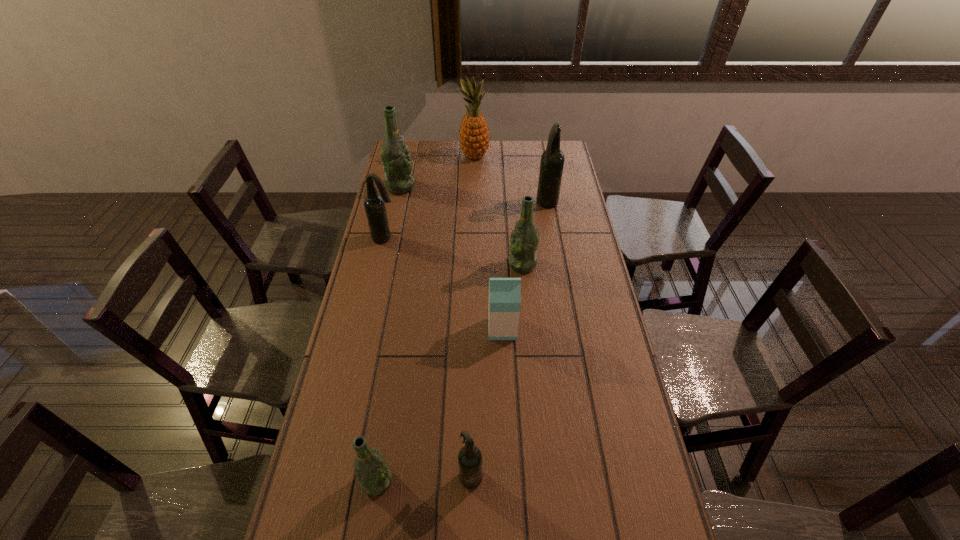
Where is `free location that satisfies the following two spatial constraints: 1. on the surface of the second farthest object; 2. on the back side of the milk carton`? This screenshot has width=960, height=540. free location that satisfies the following two spatial constraints: 1. on the surface of the second farthest object; 2. on the back side of the milk carton is located at coordinates (370, 329).